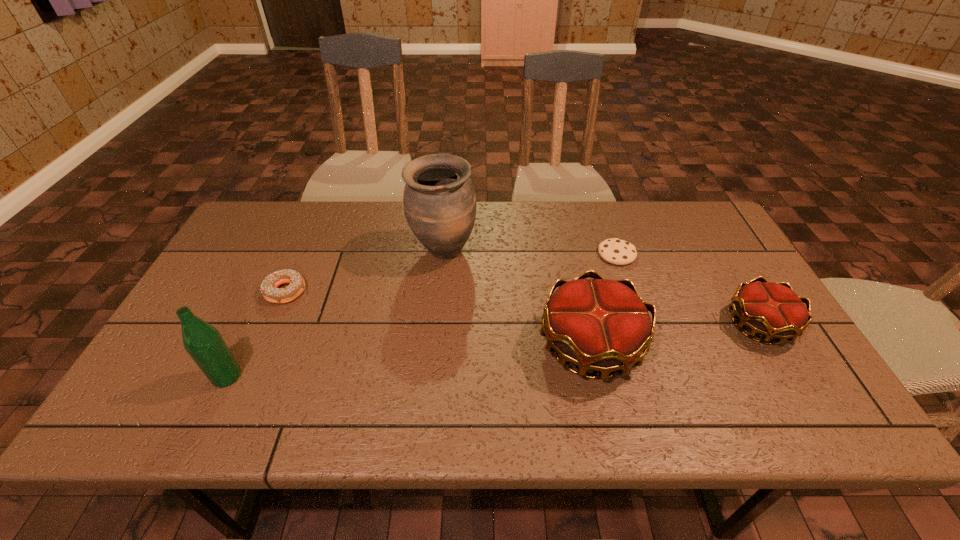
You are a GUI agent. You are given a task and a screenshot of the screen. Output one action in this format:
    pyautogui.click(x=<x>, y=<y>)
    Task: Click on the vacant point that satisfies the following two spatial constraints: 1. on the back side of the cookie; 2. on the right side of the second tallest object
    Image resolution: width=960 pixels, height=540 pixels.
    Given the screenshot: What is the action you would take?
    285,254

Where is `free space that satisfies the following two spatial constraints: 1. on the front side of the urn; 2. on the left side of the taller crown`? The image size is (960, 540). free space that satisfies the following two spatial constraints: 1. on the front side of the urn; 2. on the left side of the taller crown is located at coordinates (435, 345).